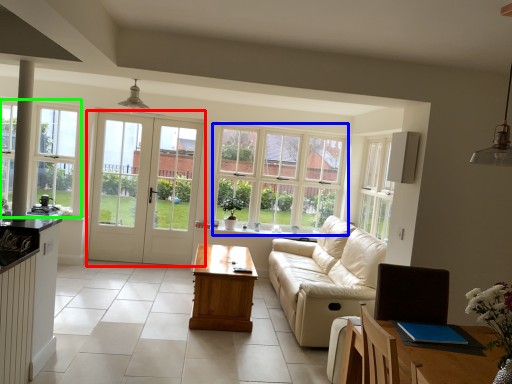
Question: Based on their relative distances, which object is farther from door (highlighted by a red box)? Choose from window (highlighted by a blue box) and window (highlighted by a green box).

Choices:
 (A) window
 (B) window

Answer: (A)